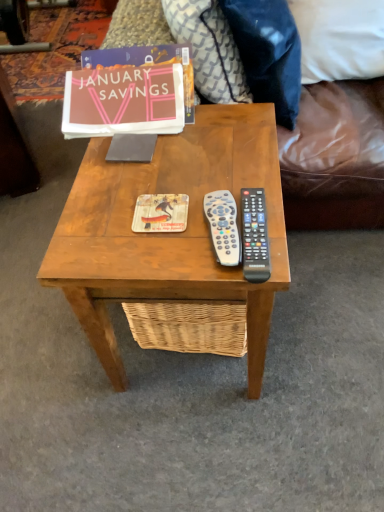
Question: Should I look upward or downward to see matte paper book cover at center?

Choices:
 (A) down
 (B) up

Answer: (B)

Question: Can you confirm if matte paper book at upper center is smaller than wooden coffee table at center?

Choices:
 (A) no
 (B) yes

Answer: (B)

Question: Is matte paper book at upper center turned away from wooden coffee table at center?

Choices:
 (A) no
 (B) yes

Answer: (A)

Question: From the image's perspective, is matte paper book at upper center on top of wooden coffee table at center?

Choices:
 (A) yes
 (B) no

Answer: (A)

Question: Is matte paper book at upper center at the right side of wooden coffee table at center?

Choices:
 (A) no
 (B) yes

Answer: (A)

Question: From a real-world perspective, is matte paper book at upper center physically below wooden coffee table at center?

Choices:
 (A) no
 (B) yes

Answer: (A)

Question: Are matte paper book at upper center and wooden coffee table at center located far from each other?

Choices:
 (A) yes
 (B) no

Answer: (B)

Question: Does black plastic remote at center right, arranged as the first remote control when viewed from the right, have a greater width compared to white fabric pillow at upper right, which ranks as the third pillow in left-to-right order?

Choices:
 (A) yes
 (B) no

Answer: (B)

Question: Is white fabric pillow at upper right, which is the 1th pillow from right to left, at the back of black plastic remote at center right, arranged as the first remote control when viewed from the right?

Choices:
 (A) no
 (B) yes

Answer: (B)

Question: Is black plastic remote at center right, arranged as the first remote control when viewed from the right, located outside white fabric pillow at upper right, which is the 1th pillow from right to left?

Choices:
 (A) no
 (B) yes

Answer: (B)

Question: From a real-world perspective, is black plastic remote at center right, placed as the second remote control when sorted from left to right, located beneath white fabric pillow at upper right, which is the 1th pillow from right to left?

Choices:
 (A) no
 (B) yes

Answer: (A)

Question: Would you say black plastic remote at center right, placed as the second remote control when sorted from left to right, is a long distance from white fabric pillow at upper right, which ranks as the third pillow in left-to-right order?

Choices:
 (A) yes
 (B) no

Answer: (B)

Question: Is the position of black plastic remote at center right, arranged as the first remote control when viewed from the right, more distant than that of white fabric pillow at upper right, which is the 1th pillow from right to left?

Choices:
 (A) no
 (B) yes

Answer: (A)

Question: Does white fabric pillow at upper right, which ranks as the third pillow in left-to-right order, have a greater width compared to white plastic remote at center, arranged as the 2th remote control when viewed from the right?

Choices:
 (A) yes
 (B) no

Answer: (A)